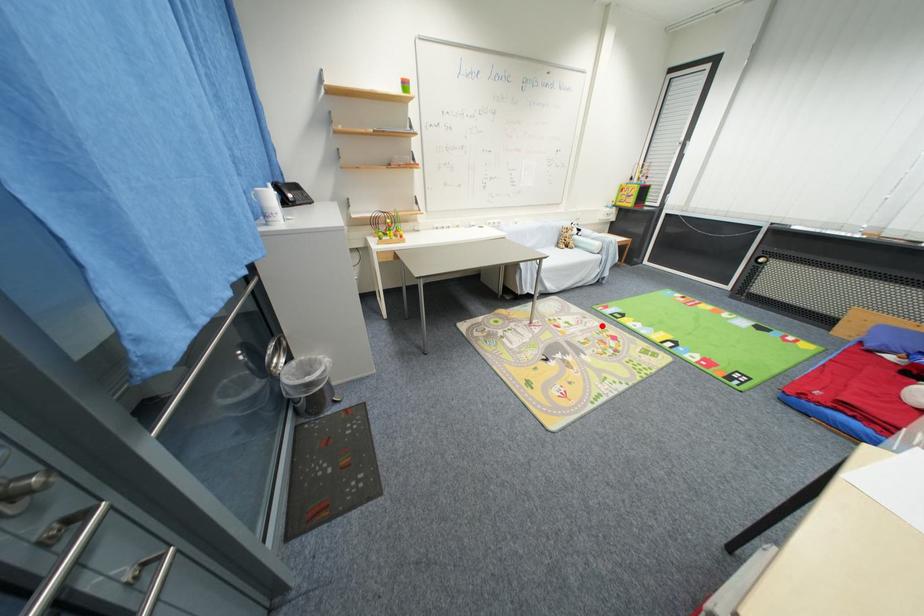
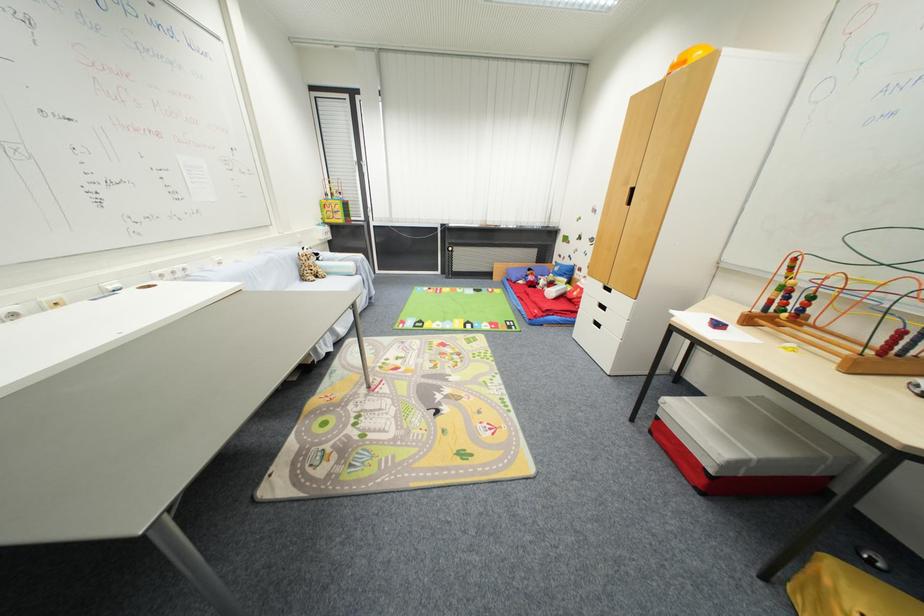
Question: I am providing you with two images of the same scene from different viewpoints. In image1, a red point is highlighted. Considering the same 3D point in image2, which of the following is correct?

Choices:
 (A) It is closer
 (B) It is farther

Answer: (A)